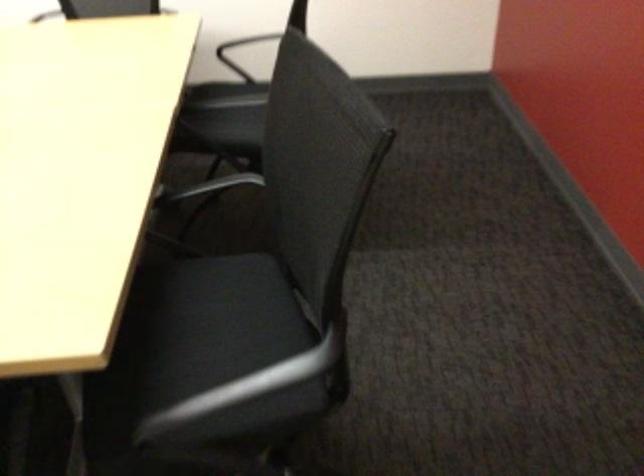
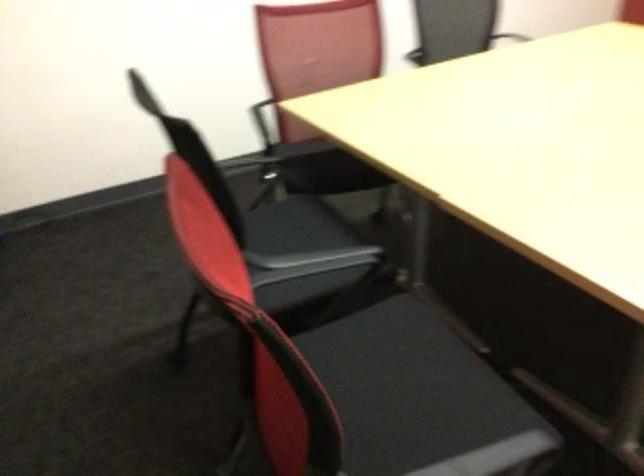
Question: In a continuous first-person perspective shot, in which direction is the camera moving?

Choices:
 (A) Left
 (B) Right
 (C) Forward
 (D) Backward

Answer: (A)